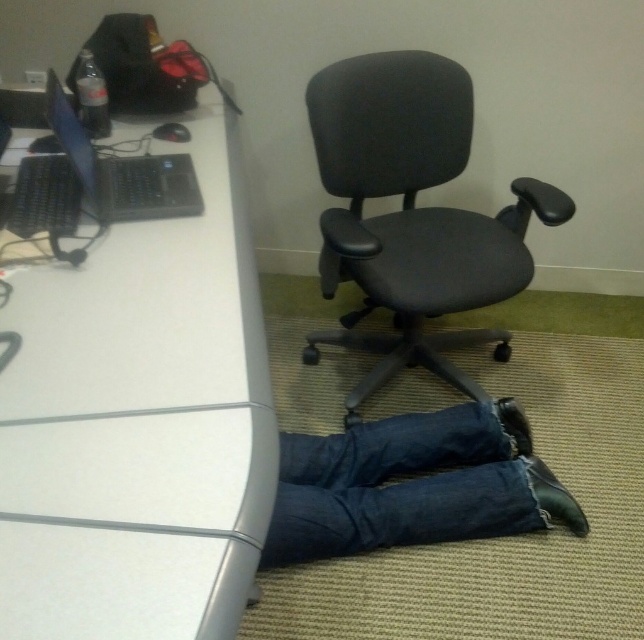
You are trying to fit a new desk lamp between the black fabric swivel chair at center and the denim at lower center. Based on their widths, will there be enough space for the lamp?

The black fabric swivel chair at center might be wider than denim at lower center, so there may not be enough space for the desk lamp between them.

Based on the photo, you are an office worker who needs to reach the black leather shoe at lower right to put it on. However, the white glossy computer desk at upper left is blocking your path. Can you move the desk to access the shoe?

The white glossy computer desk at upper left is positioned over black leather shoe at lower right, so moving the desk would allow you to access the shoe.

You are organizing the office and need to place a new item between the black fabric swivel chair at center and the denim at lower center. Which object should you place closer to the edge of the desk to ensure stability?

The black fabric swivel chair at center is larger in size than denim at lower center, so placing the larger object closer to the edge of the desk would provide better stability.